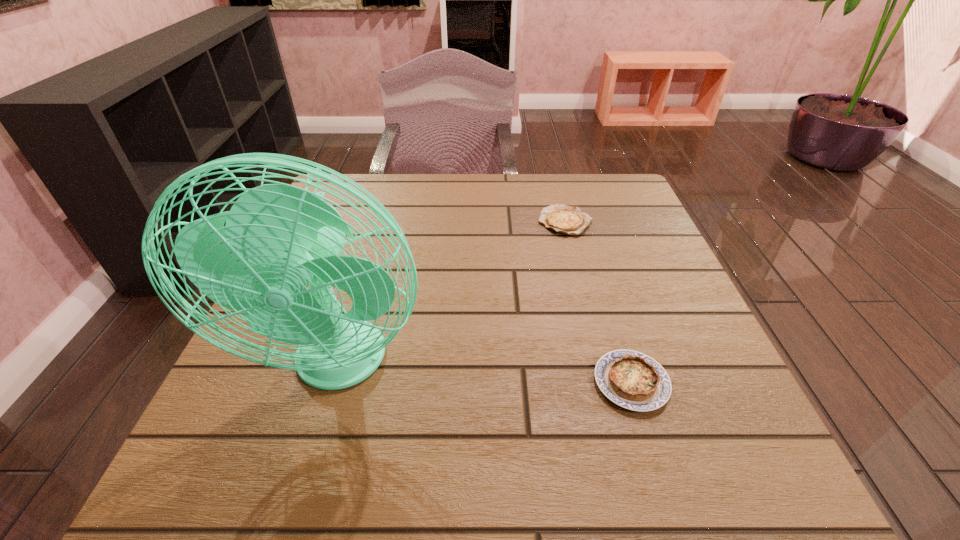
In order to click on fan in this screenshot , I will do `click(279, 239)`.

Where is `the tallest object`? the tallest object is located at coordinates (279, 239).

The width and height of the screenshot is (960, 540). Find the location of `the taller quiche`. the taller quiche is located at coordinates point(632,380).

At what (x,y) coordinates should I click in order to perform the action: click on the second tallest object. Please return your answer as a coordinate pair (x, y). Looking at the image, I should click on (632, 380).

The height and width of the screenshot is (540, 960). What are the coordinates of `the farther quiche` in the screenshot? It's located at (563, 219).

The image size is (960, 540). I want to click on the farthest object, so click(x=563, y=219).

Where is `blank space located in front of the tallest object to blow air`? The width and height of the screenshot is (960, 540). blank space located in front of the tallest object to blow air is located at coordinates (302, 486).

Find the location of a particular element. This screenshot has width=960, height=540. vacant space located 0.290m on the left of the second tallest object is located at coordinates (411, 382).

Where is `vacant space situated 0.070m on the right of the shorter quiche`? vacant space situated 0.070m on the right of the shorter quiche is located at coordinates (622, 221).

Image resolution: width=960 pixels, height=540 pixels. Find the location of `object located at the far edge`. object located at the far edge is located at coordinates (563, 219).